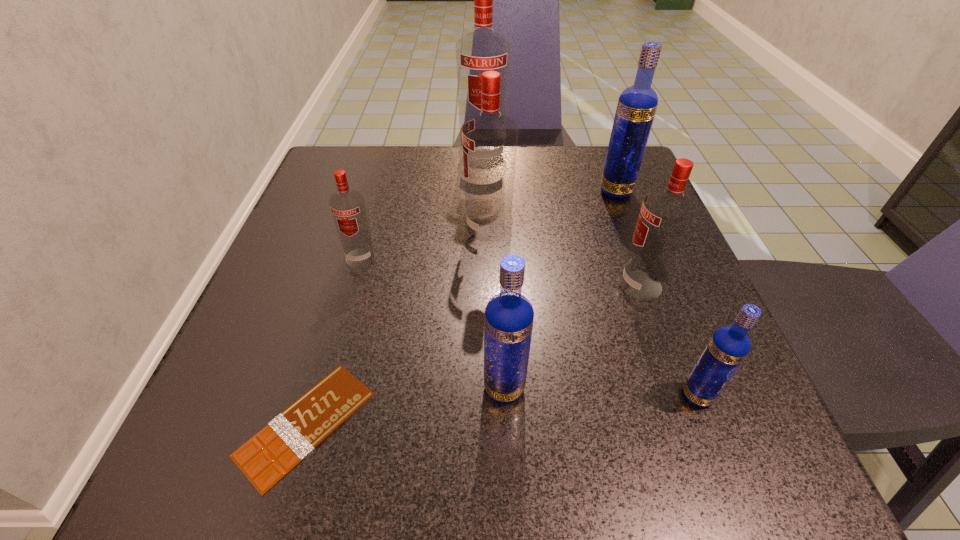
The image size is (960, 540). What are the coordinates of `the tallest vodka` in the screenshot? It's located at coord(483,49).

Where is `the farthest vodka`? the farthest vodka is located at coordinates (483, 49).

The image size is (960, 540). What are the coordinates of `the biggest blue vodka` in the screenshot? It's located at (637, 104).

Identify the location of the seventh nearest object. This screenshot has width=960, height=540. (637, 104).

Identify the location of the second biggest red vodka. This screenshot has width=960, height=540. 490,138.

Where is `the third farthest object`? The height and width of the screenshot is (540, 960). the third farthest object is located at coordinates (490, 138).

This screenshot has height=540, width=960. In order to click on the leftmost blue vodka in this screenshot , I will do `click(508, 322)`.

The height and width of the screenshot is (540, 960). What are the coordinates of `the third nearest vodka` in the screenshot? It's located at (665, 217).

At what (x,y) coordinates should I click in order to perform the action: click on the second smallest red vodka. Please return your answer as a coordinate pair (x, y). Image resolution: width=960 pixels, height=540 pixels. Looking at the image, I should click on (665, 217).

Identify the location of the smallest blue vodka. (728, 347).